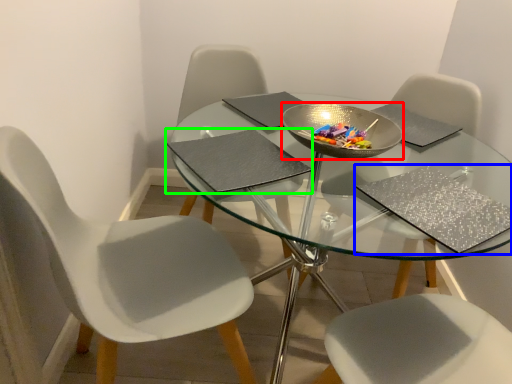
Question: Which object is the farthest from bowl (highlighted by a red box)? Choose among these: place mat (highlighted by a blue box) or place mat (highlighted by a green box).

Choices:
 (A) place mat
 (B) place mat

Answer: (A)